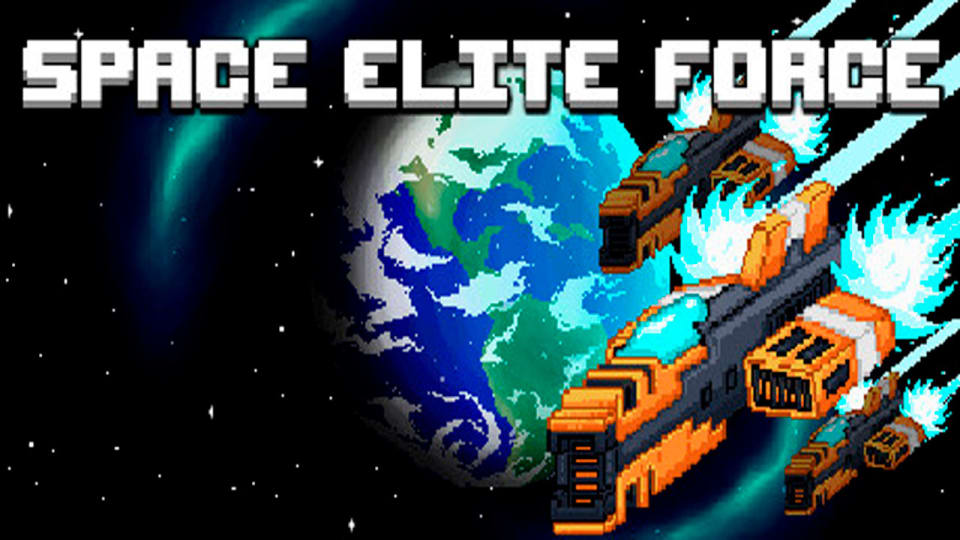
Locate an element on the screen. The width and height of the screenshot is (960, 540). globe is located at coordinates tap(484, 284).